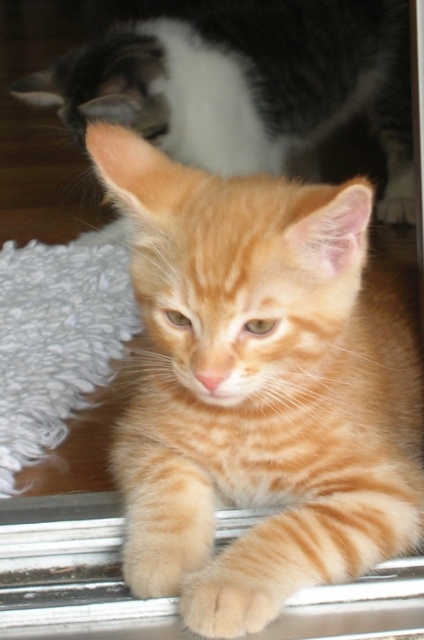
Question: Which point is farther from the camera taking this photo?

Choices:
 (A) (187, 618)
 (B) (30, 570)

Answer: (B)

Question: Is orange striped kitten at center to the right of soft orange fur paw at lower center from the viewer's perspective?

Choices:
 (A) yes
 (B) no

Answer: (A)

Question: Which point appears closest to the camera in this image?

Choices:
 (A) (60, 515)
 (B) (214, 609)
 (C) (142, 412)
 (D) (334, 65)

Answer: (B)

Question: Is orange striped kitten at center wider than orange tabby kitten at upper center?

Choices:
 (A) yes
 (B) no

Answer: (B)

Question: Is orange tabby kitten at upper center to the right of metallic silver window sill at lower center from the viewer's perspective?

Choices:
 (A) yes
 (B) no

Answer: (A)

Question: Which object appears closest to the camera in this image?

Choices:
 (A) soft orange fur paw at lower center
 (B) metallic silver window sill at lower center
 (C) orange tabby kitten at upper center
 (D) orange striped kitten at center

Answer: (D)